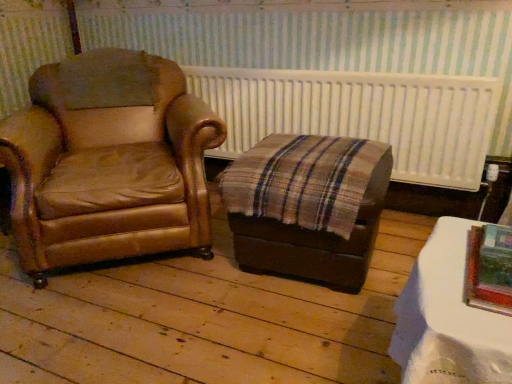
Find the location of `free space above white glossy table at lower right (from a real-world perspective)`. free space above white glossy table at lower right (from a real-world perspective) is located at coordinates (459, 275).